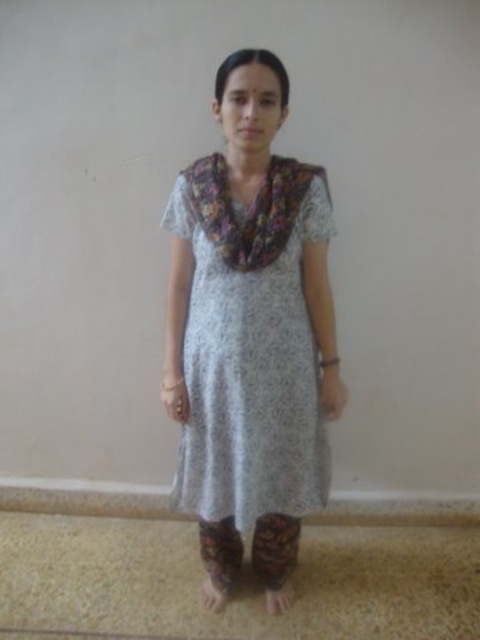
Question: Is white printed dress at center bigger than floral fabric scarf at center?

Choices:
 (A) yes
 (B) no

Answer: (A)

Question: Does white printed dress at center lie behind floral fabric scarf at center?

Choices:
 (A) no
 (B) yes

Answer: (B)

Question: Among these points, which one is nearest to the camera?

Choices:
 (A) (309, 230)
 (B) (242, 227)

Answer: (B)

Question: Observing the image, what is the correct spatial positioning of white printed dress at center in reference to floral fabric scarf at center?

Choices:
 (A) above
 (B) below

Answer: (B)